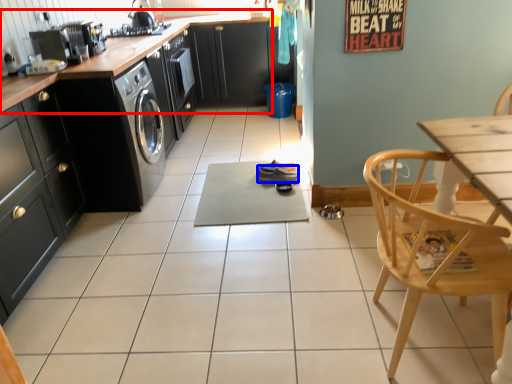
Question: Among these objects, which one is nearest to the camera, countertop (highlighted by a red box) or shoe (highlighted by a blue box)?

Choices:
 (A) countertop
 (B) shoe

Answer: (A)